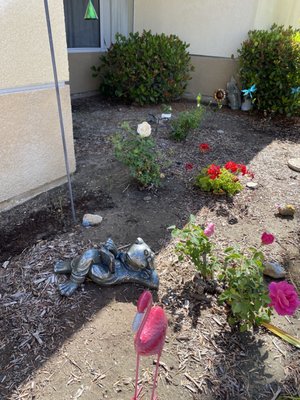
Identify the location of wall. (196, 31).